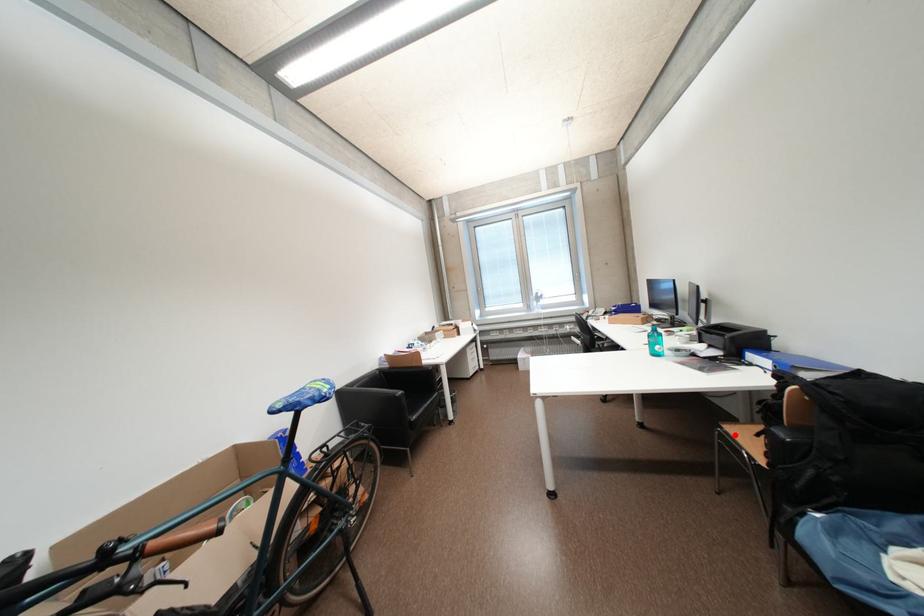
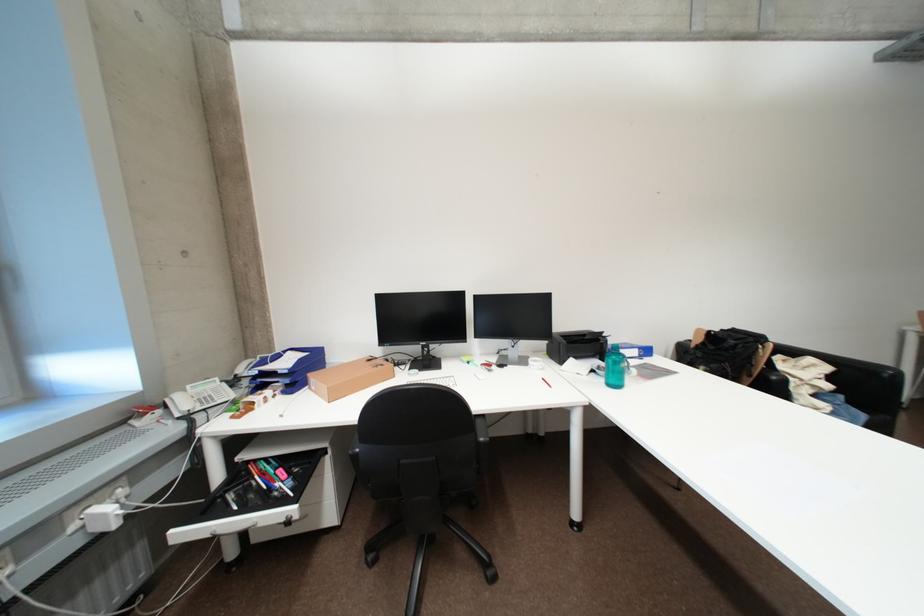
Question: I am providing you with two images of the same scene from different viewpoints. A red point is marked on the first image. Can you still see the location of the red point in image 2?

Choices:
 (A) Yes
 (B) No

Answer: (B)